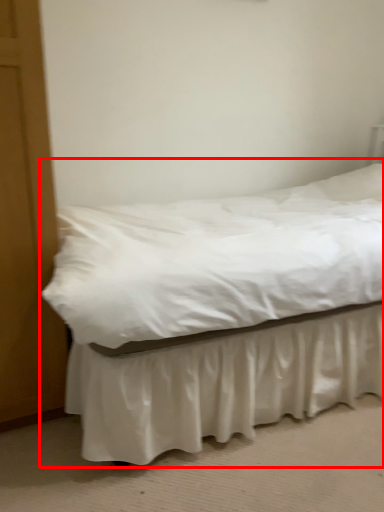
Question: From the image, what is the correct spatial relationship of bed (annotated by the red box) in relation to bed frame?

Choices:
 (A) right
 (B) left

Answer: (A)